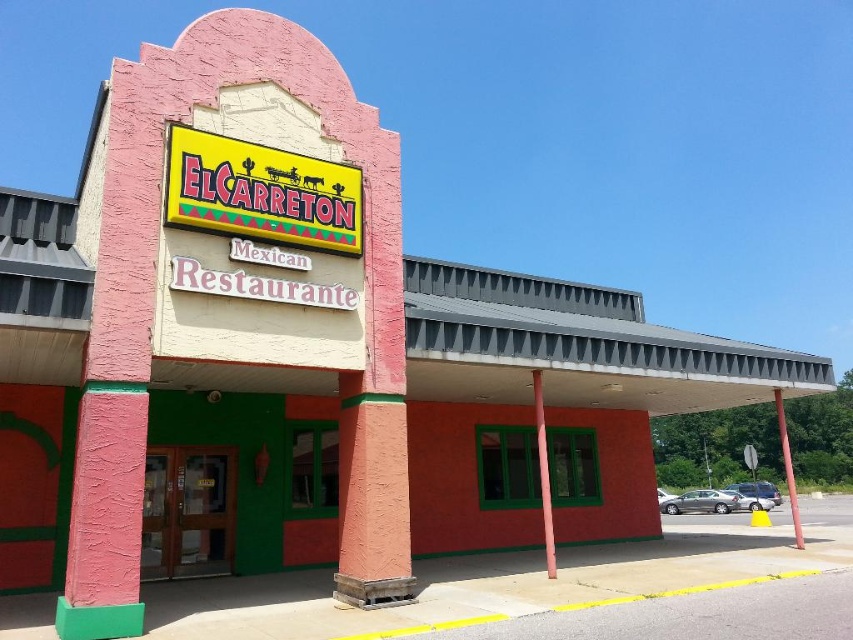
Question: Is yellow plastic sign at center below pink matte pole at center?

Choices:
 (A) yes
 (B) no

Answer: (B)

Question: Considering the relative positions of yellow plastic sign at center and red painted metal pole at center in the image provided, where is yellow plastic sign at center located with respect to red painted metal pole at center?

Choices:
 (A) right
 (B) left

Answer: (B)

Question: Which object is closer to the camera taking this photo?

Choices:
 (A) pink matte pole at center
 (B) red painted metal pole at center

Answer: (A)

Question: Which object is farther from the camera taking this photo?

Choices:
 (A) yellow plastic sign at center
 (B) red painted metal pole at center

Answer: (B)

Question: Can you confirm if yellow plastic sign at center is positioned to the left of red painted metal pole at center?

Choices:
 (A) no
 (B) yes

Answer: (B)

Question: Which of the following is the farthest from the observer?

Choices:
 (A) pink matte pole at center
 (B) yellow plastic sign at center

Answer: (A)